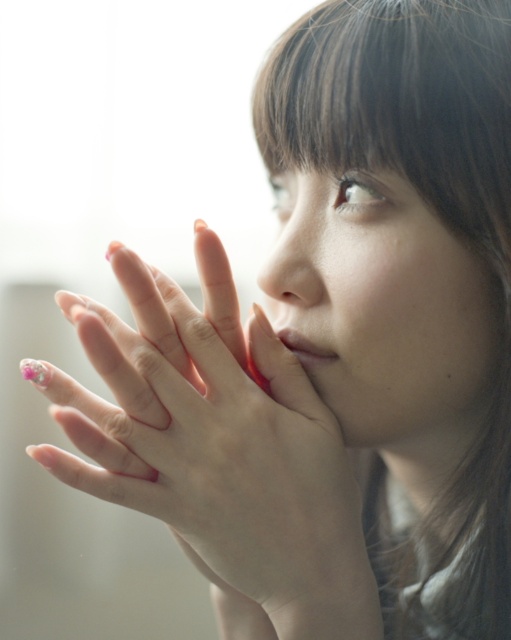
Is pink nail polish at center thinner than smooth skin face at center?

Incorrect, pink nail polish at center's width is not less than smooth skin face at center's.

Does pink nail polish at center have a smaller size compared to smooth skin face at center?

No, pink nail polish at center is not smaller than smooth skin face at center.

Is point (241, 467) positioned in front of point (313, 280)?

Yes, point (241, 467) is in front of point (313, 280).

At what (x,y) coordinates should I click in order to perform the action: click on pink nail polish at center. Please return your answer as a coordinate pair (x, y). The width and height of the screenshot is (511, 640). Looking at the image, I should click on (213, 438).

Does smooth skin face at center have a greater width compared to matte pink lipstick at center?

Correct, the width of smooth skin face at center exceeds that of matte pink lipstick at center.

Does smooth skin face at center appear under matte pink lipstick at center?

No, smooth skin face at center is not below matte pink lipstick at center.

Does point (364, 412) come in front of point (304, 352)?

Yes, it is in front of point (304, 352).

You are a GUI agent. You are given a task and a screenshot of the screen. Output one action in this format:
    pyautogui.click(x=<x>, y=<y>)
    Task: Click on the smooth skin face at center
    This screenshot has height=640, width=511.
    Given the screenshot: What is the action you would take?
    pyautogui.click(x=383, y=308)

Can you confirm if pink nail polish at center is smaller than matte pink lipstick at center?

No, pink nail polish at center is not smaller than matte pink lipstick at center.

Who is higher up, pink nail polish at center or matte pink lipstick at center?

matte pink lipstick at center is higher up.

Describe the element at coordinates (213, 438) in the screenshot. I see `pink nail polish at center` at that location.

Image resolution: width=511 pixels, height=640 pixels. What are the coordinates of `pink nail polish at center` in the screenshot? It's located at (213, 438).